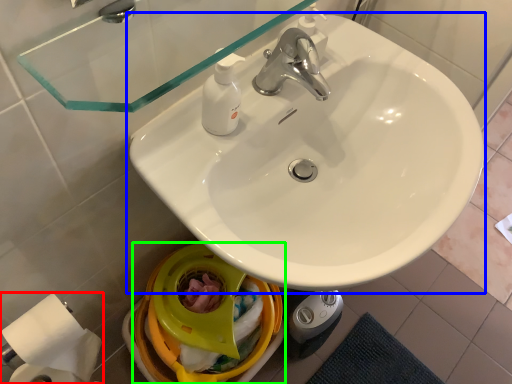
Question: Based on their relative distances, which object is nearer to toilet paper (highlighted by a red box)? Choose from sink (highlighted by a blue box) and bidet (highlighted by a green box).

Choices:
 (A) sink
 (B) bidet

Answer: (B)